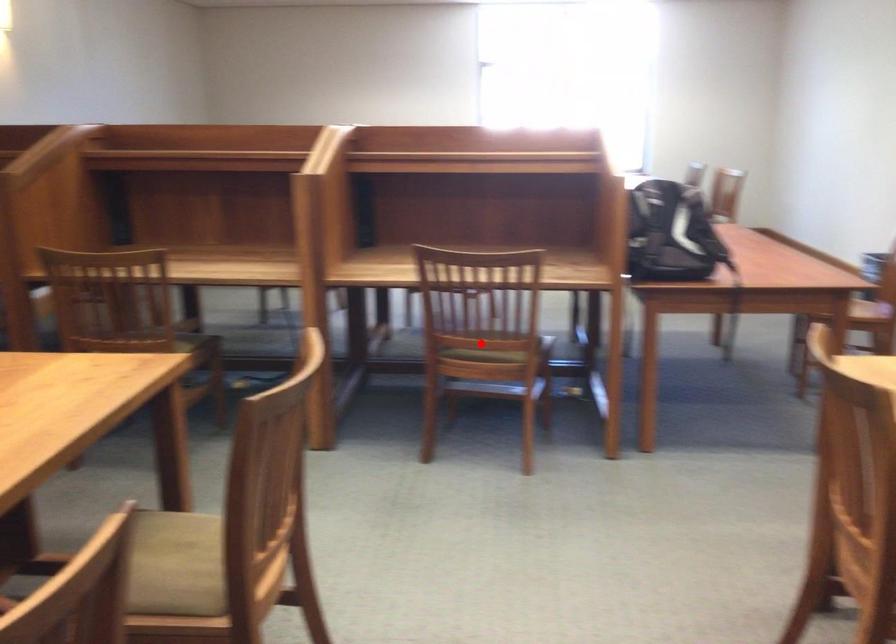
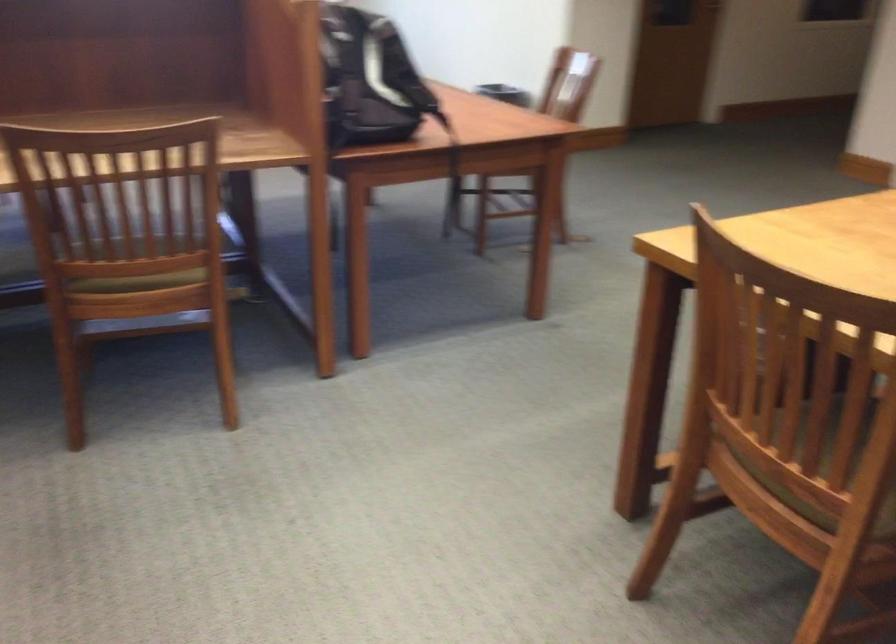
Question: I am providing you with two images of the same scene from different viewpoints. In image1, a red point is highlighted. Considering the same 3D point in image2, which of the following is correct?

Choices:
 (A) It is closer
 (B) It is farther

Answer: (A)